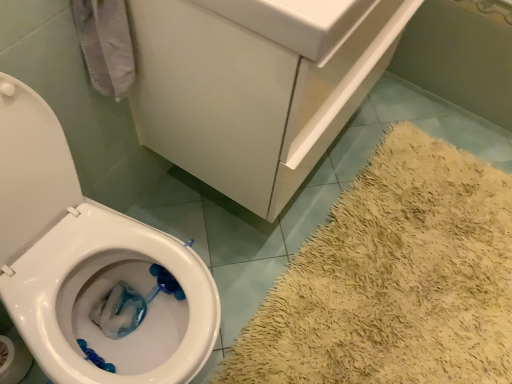
Question: Considering the relative positions of white glossy sink at upper center and white glossy bathtub at lower right in the image provided, is white glossy sink at upper center to the left or to the right of white glossy bathtub at lower right?

Choices:
 (A) left
 (B) right

Answer: (A)

Question: Is point (302, 38) positioned closer to the camera than point (489, 109)?

Choices:
 (A) closer
 (B) farther

Answer: (A)

Question: Considering the real-world distances, which object is farthest from the white glossy sink at upper center?

Choices:
 (A) white glossy bathtub at lower right
 (B) white paper at lower left

Answer: (A)

Question: Which of these objects is positioned farthest from the white paper at lower left?

Choices:
 (A) white glossy sink at upper center
 (B) white glossy bathtub at lower right

Answer: (B)